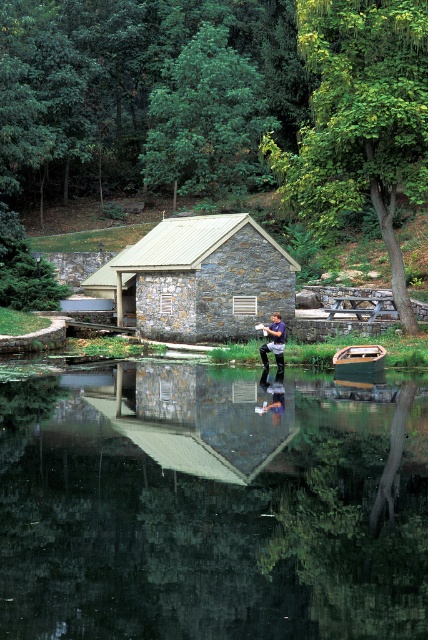
Question: Which object is the closest to the dark blue shirt at center?

Choices:
 (A) smooth reflective water at center
 (B) stone/rough hut at center

Answer: (A)

Question: Is stone/rough hut at center closer to camera compared to dark blue shirt at center?

Choices:
 (A) yes
 (B) no

Answer: (B)

Question: Is stone/rough hut at center above dark blue shirt at center?

Choices:
 (A) yes
 (B) no

Answer: (A)

Question: Which point is farther from the camera taking this photo?

Choices:
 (A) (110, 262)
 (B) (269, 342)

Answer: (A)

Question: Does smooth reflective water at center have a greater width compared to dark blue shirt at center?

Choices:
 (A) yes
 (B) no

Answer: (A)

Question: Which of the following is the closest to the observer?

Choices:
 (A) (276, 356)
 (B) (360, 365)

Answer: (B)